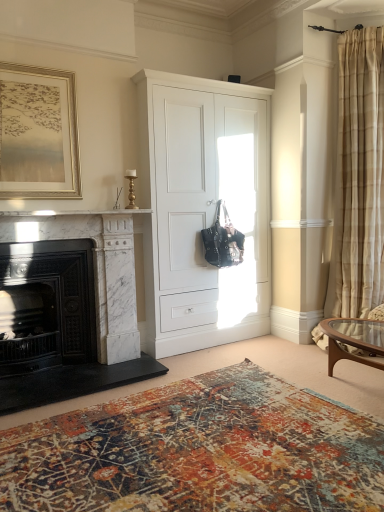
Locate an element on the screen. This screenshot has height=512, width=384. vacant point above gold metallic picture frame at upper left (from a real-world perspective) is located at coordinates (33, 64).